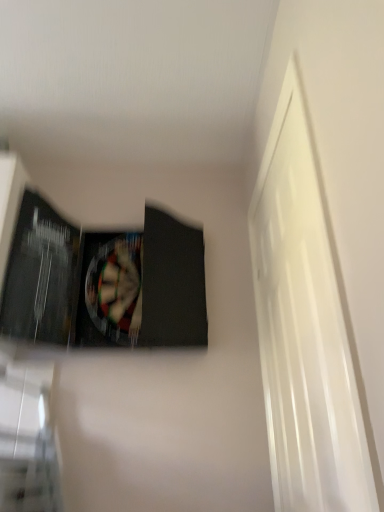
Question: Is there a large distance between matte black paperback book at upper left and white glossy door at right?

Choices:
 (A) yes
 (B) no

Answer: (B)

Question: Is matte black paperback book at upper left facing towards white glossy door at right?

Choices:
 (A) no
 (B) yes

Answer: (A)

Question: From a real-world perspective, does matte black paperback book at upper left stand above white glossy door at right?

Choices:
 (A) yes
 (B) no

Answer: (A)

Question: Is white glossy door at right surrounded by matte black paperback book at upper left?

Choices:
 (A) no
 (B) yes

Answer: (A)

Question: From a real-world perspective, is matte black paperback book at upper left below white glossy door at right?

Choices:
 (A) no
 (B) yes

Answer: (A)

Question: Can you confirm if matte black paperback book at upper left is shorter than white glossy door at right?

Choices:
 (A) no
 (B) yes

Answer: (B)

Question: Is white glossy door at right positioned far away from matte black paperback book at upper left?

Choices:
 (A) yes
 (B) no

Answer: (B)

Question: Is white glossy door at right positioned in front of matte black paperback book at upper left?

Choices:
 (A) no
 (B) yes

Answer: (B)

Question: Can you confirm if white glossy door at right is wider than matte black paperback book at upper left?

Choices:
 (A) yes
 (B) no

Answer: (B)

Question: Considering the relative positions of white glossy door at right and matte black paperback book at upper left in the image provided, is white glossy door at right to the right of matte black paperback book at upper left from the viewer's perspective?

Choices:
 (A) no
 (B) yes

Answer: (B)

Question: From a real-world perspective, is white glossy door at right beneath matte black paperback book at upper left?

Choices:
 (A) yes
 (B) no

Answer: (A)

Question: Does white glossy door at right have a lesser width compared to matte black paperback book at upper left?

Choices:
 (A) yes
 (B) no

Answer: (A)

Question: From a real-world perspective, relative to white glossy door at right, is matte black paperback book at upper left vertically above or below?

Choices:
 (A) below
 (B) above

Answer: (B)